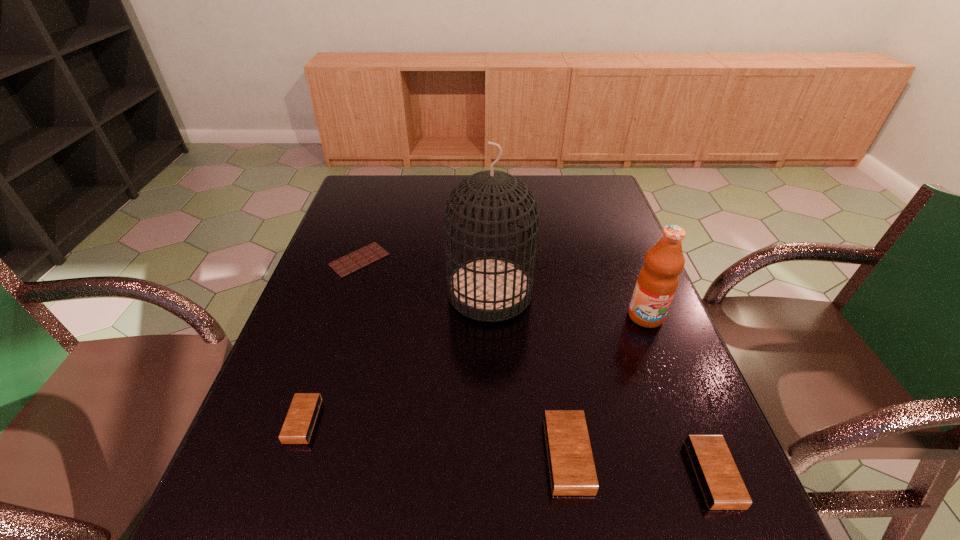
At what (x,y) coordinates should I click in order to perform the action: click on free space that satisfies the following two spatial constraints: 1. on the front label of the second tallest object; 2. on the front face of the tallest alarm clock. Please return your answer as a coordinate pair (x, y). Looking at the image, I should click on (700, 456).

Where is `vacant space that satisfies the following two spatial constraints: 1. on the front label of the fifth shortest object; 2. on the front face of the fifth tallest object`? The height and width of the screenshot is (540, 960). vacant space that satisfies the following two spatial constraints: 1. on the front label of the fifth shortest object; 2. on the front face of the fifth tallest object is located at coordinates (686, 421).